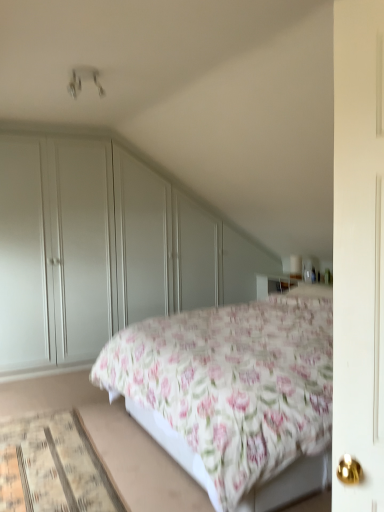
Identify the location of free space above beige woven mat at lower left (from a real-world perspective). (53, 456).